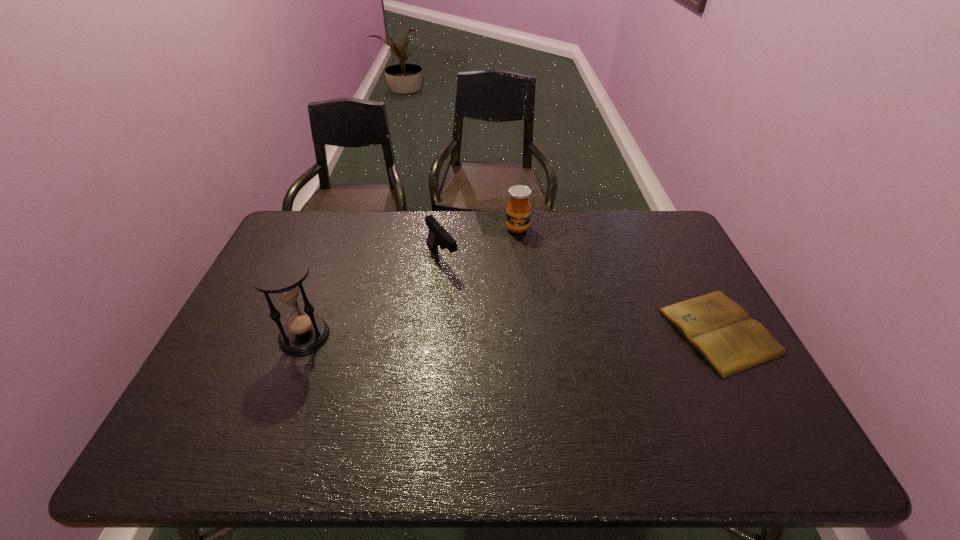
Where is `vacant region at the far edge`? vacant region at the far edge is located at coordinates (522, 239).

This screenshot has width=960, height=540. In order to click on free space at the near edge of the desktop in this screenshot , I will do `click(414, 399)`.

At what (x,y) coordinates should I click in order to perform the action: click on vacant area at the left edge of the desktop. Please return your answer as a coordinate pair (x, y). This screenshot has width=960, height=540. Looking at the image, I should click on (248, 348).

You are a GUI agent. You are given a task and a screenshot of the screen. Output one action in this format:
    pyautogui.click(x=<x>, y=<y>)
    Task: Click on the vacant region at the right edge of the desktop
    
    Given the screenshot: What is the action you would take?
    pyautogui.click(x=673, y=255)

Locate an element on the screen. The height and width of the screenshot is (540, 960). vacant position at the far right corner of the desktop is located at coordinates (663, 248).

Where is `vacant region between the hourglass and the pistol`? vacant region between the hourglass and the pistol is located at coordinates (373, 297).

Image resolution: width=960 pixels, height=540 pixels. I want to click on empty space that is in between the pistol and the honey, so click(x=480, y=243).

Locate an element on the screen. vacant space that is in between the rightmost object and the third object from left to right is located at coordinates (618, 280).

Locate an element on the screen. The width and height of the screenshot is (960, 540). unoccupied area between the farthest object and the rightmost object is located at coordinates (618, 280).

Where is `unoccupied area between the pistol and the tallest object`? unoccupied area between the pistol and the tallest object is located at coordinates (373, 297).